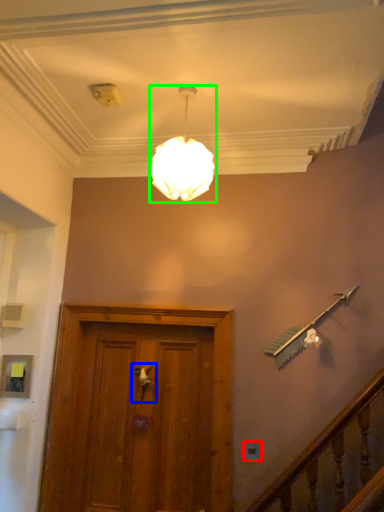
Question: Which object is positioned closest to electric outlet (highlighted by a red box)? Select from door handle (highlighted by a blue box) and lamp (highlighted by a green box).

Choices:
 (A) door handle
 (B) lamp

Answer: (A)